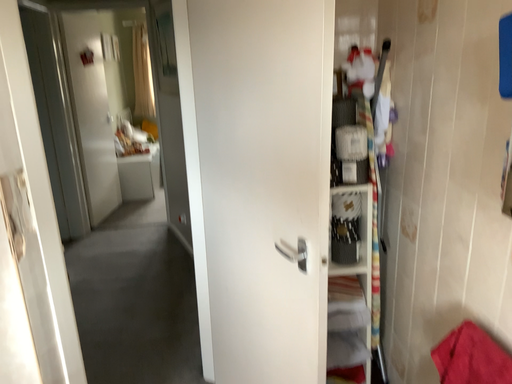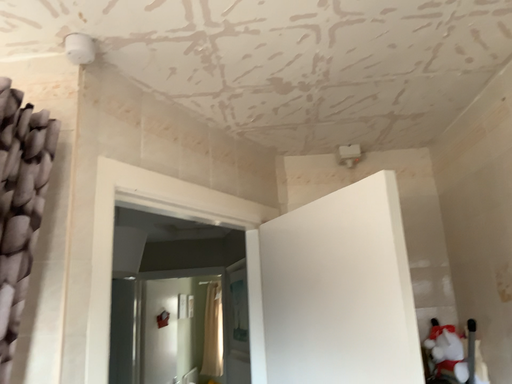
Question: How did the camera likely rotate when shooting the video?

Choices:
 (A) rotated right
 (B) rotated left

Answer: (B)